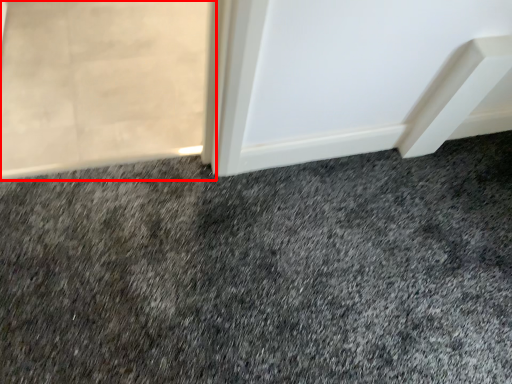
Question: From the image, what is the correct spatial relationship of screen door (annotated by the red box) in relation to granite?

Choices:
 (A) left
 (B) right

Answer: (A)